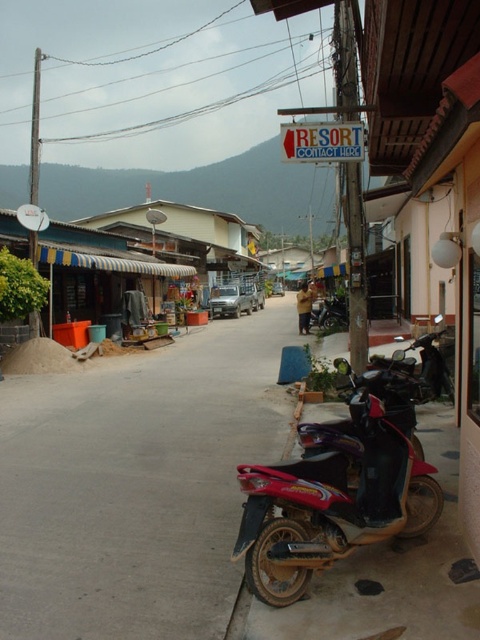
Question: Which point is farther to the camera?

Choices:
 (A) (104, 560)
 (B) (312, 426)

Answer: (B)

Question: Does smooth concrete alley at center appear on the left side of shiny red motorcycle at lower right?

Choices:
 (A) no
 (B) yes

Answer: (B)

Question: Does smooth concrete alley at center appear on the left side of shiny red motorcycle at lower right?

Choices:
 (A) yes
 (B) no

Answer: (A)

Question: Which point appears farthest from the camera in this image?

Choices:
 (A) (370, 371)
 (B) (108, 429)

Answer: (B)

Question: Can you confirm if smooth concrete alley at center is smaller than shiny red motorcycle at lower right?

Choices:
 (A) no
 (B) yes

Answer: (A)